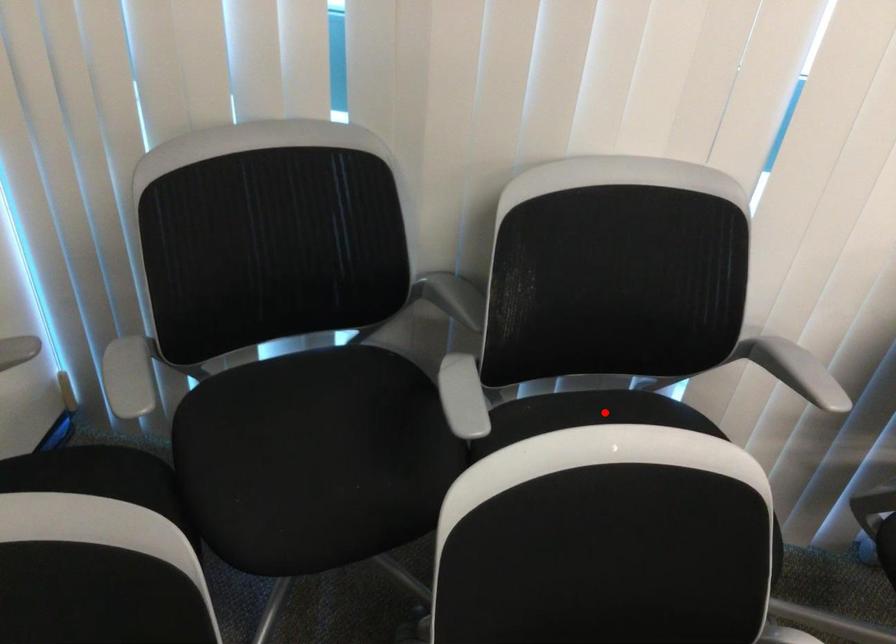
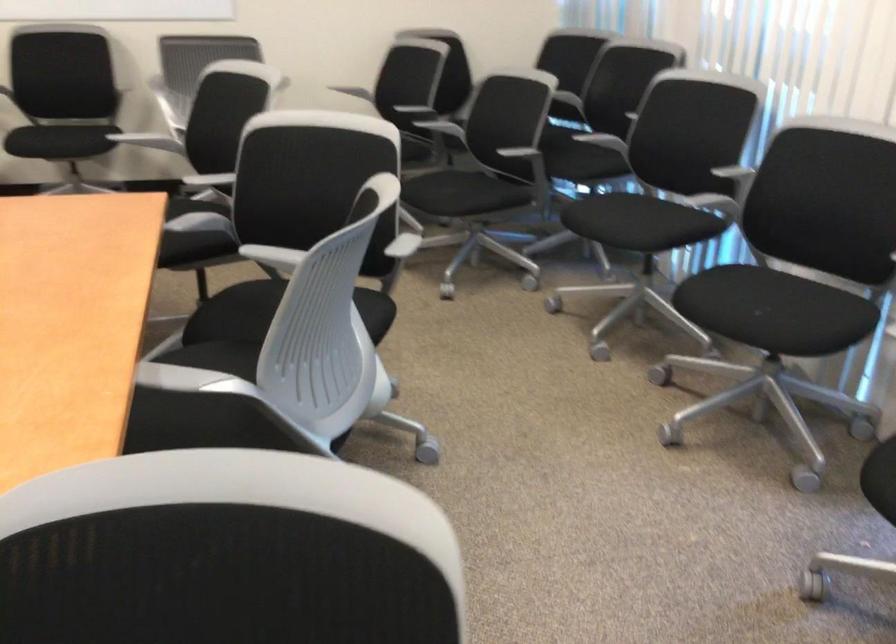
Question: I am providing you with two images of the same scene from different viewpoints. A red point is marked on the first image. Is the red point's position out of view in image 2?

Choices:
 (A) Yes
 (B) No

Answer: (A)